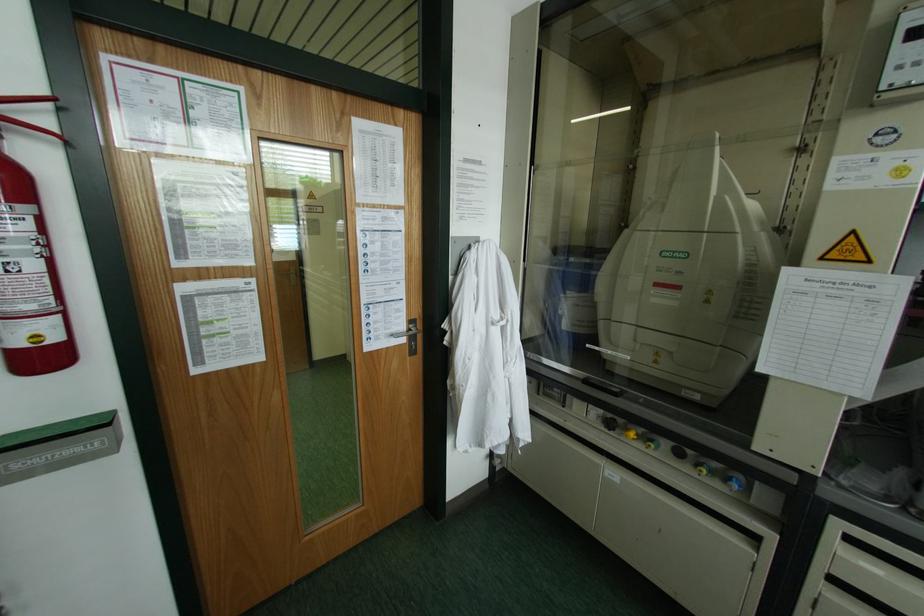
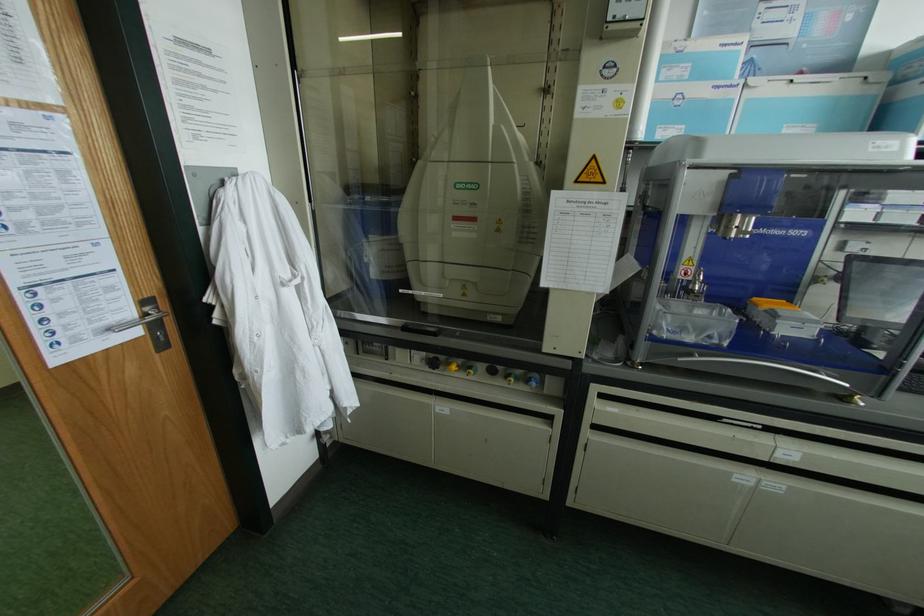
Locate, in the second image, the point that corresponds to (x=610, y=424) in the first image.

(432, 363)